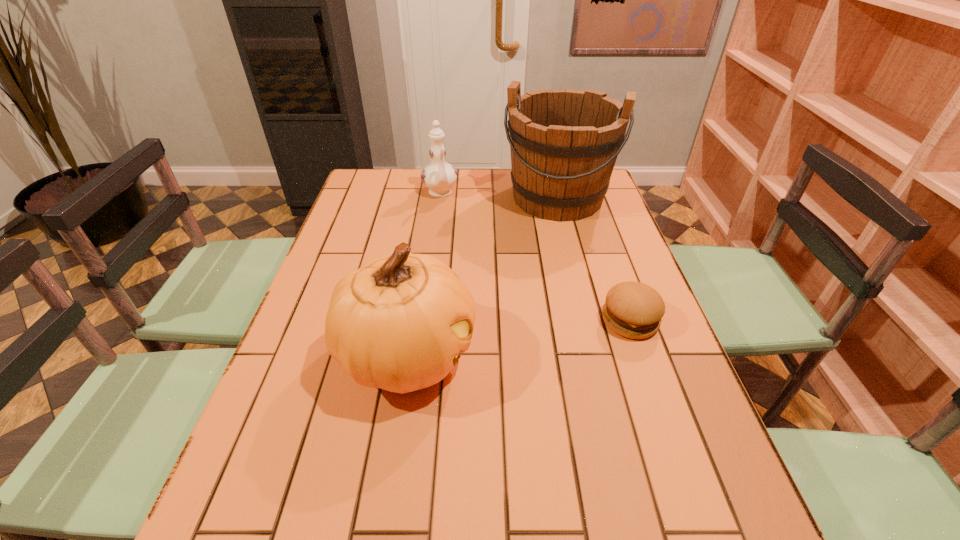
The width and height of the screenshot is (960, 540). In order to click on pumpkin in this screenshot , I will do `click(398, 323)`.

Find the location of a particular element. hamburger is located at coordinates (632, 309).

You are a GUI agent. You are given a task and a screenshot of the screen. Output one action in this format:
    pyautogui.click(x=<x>, y=<y>)
    Task: Click on the chinaware
    This screenshot has height=540, width=960.
    Given the screenshot: What is the action you would take?
    pyautogui.click(x=439, y=176)

Locate an element on the screen. This screenshot has width=960, height=540. wine bucket is located at coordinates (564, 143).

Image resolution: width=960 pixels, height=540 pixels. Identify the location of vacant space located on the front face of the pumpkin. (498, 354).

Identify the location of free space located on the front of the hamburger. The width and height of the screenshot is (960, 540). (646, 366).

Locate an element on the screen. This screenshot has width=960, height=540. free space located 0.390m at the spout of the chinaware is located at coordinates (471, 278).

I want to click on free region located 0.370m at the spout of the chinaware, so click(x=469, y=274).

At what (x,y) coordinates should I click in order to perform the action: click on free location located at the spout of the chinaware. Please return your answer as a coordinate pair (x, y). Looking at the image, I should click on (453, 230).

This screenshot has height=540, width=960. What are the coordinates of `free space located 0.360m on the side of the tallest object with the handle for carrying` in the screenshot? It's located at (522, 302).